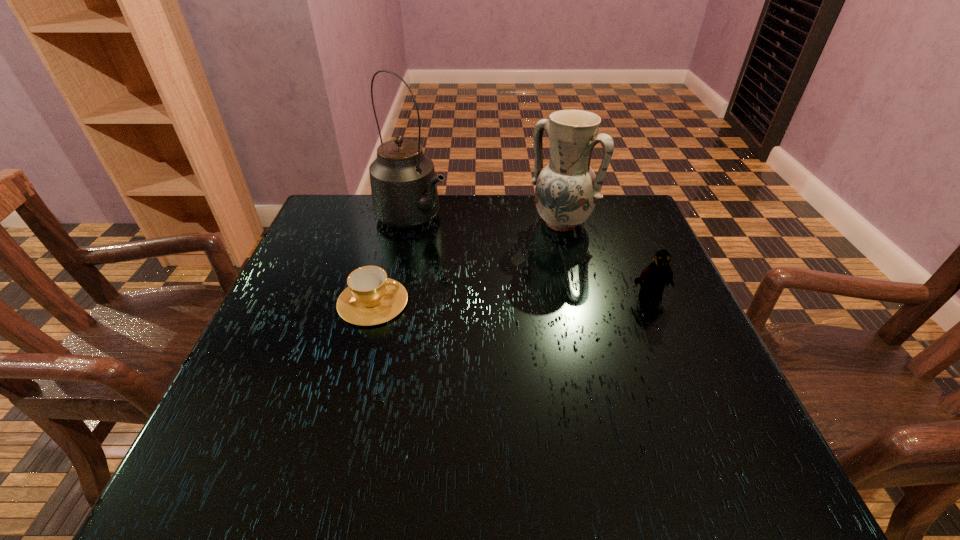
Locate which object ranks third in proximity to the second shortest object. Please provide its 2D coordinates. Your answer should be formatted as a tuple, i.e. [(x, y)], where the tuple contains the x and y coordinates of a point satisfying the conditions above.

[(371, 298)]

The image size is (960, 540). Find the location of `vacant space that satisfies the following two spatial constraints: 1. on the front side of the tallest object; 2. on the right side of the third shortest object`. vacant space that satisfies the following two spatial constraints: 1. on the front side of the tallest object; 2. on the right side of the third shortest object is located at coordinates (411, 223).